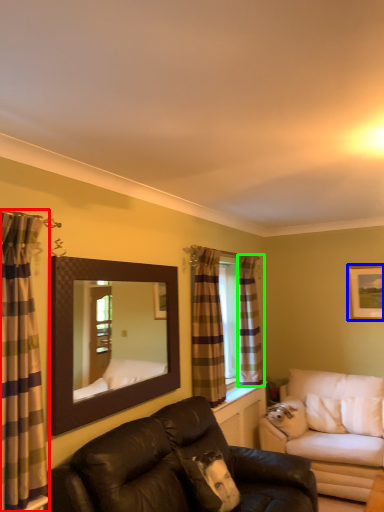
Question: Which is nearer to the curtain (highlighted by a red box)? picture frame (highlighted by a blue box) or curtain (highlighted by a green box).

Choices:
 (A) picture frame
 (B) curtain

Answer: (B)